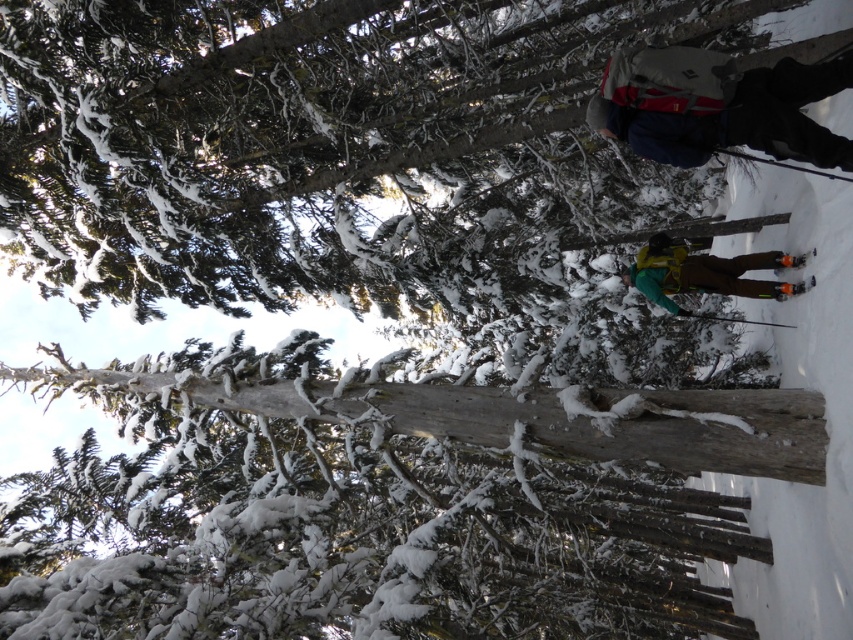
Is point (618, 51) closer to viewer compared to point (788, 285)?

Yes, point (618, 51) is closer to viewer.

Can you confirm if gray fabric backpack at upper right is positioned above orange reflective ski at lower right?

Correct, gray fabric backpack at upper right is located above orange reflective ski at lower right.

The image size is (853, 640). I want to click on gray fabric backpack at upper right, so point(717,106).

This screenshot has height=640, width=853. Identify the location of gray fabric backpack at upper right. (717, 106).

Is gray fabric backpack at upper right shorter than yellow-green fabric snowboard at center?

Correct, gray fabric backpack at upper right is not as tall as yellow-green fabric snowboard at center.

Does point (792, 156) lie in front of point (741, 253)?

Yes.

Describe the element at coordinates (717, 106) in the screenshot. The width and height of the screenshot is (853, 640). I see `gray fabric backpack at upper right` at that location.

The width and height of the screenshot is (853, 640). Identify the location of gray fabric backpack at upper right. (717, 106).

Is yellow-green fabric snowboard at center thinner than orange reflective ski at lower right?

In fact, yellow-green fabric snowboard at center might be wider than orange reflective ski at lower right.

In the scene shown: Between yellow-green fabric snowboard at center and orange reflective ski at lower right, which one has less height?

orange reflective ski at lower right

The width and height of the screenshot is (853, 640). Describe the element at coordinates (706, 273) in the screenshot. I see `yellow-green fabric snowboard at center` at that location.

The height and width of the screenshot is (640, 853). I want to click on yellow-green fabric snowboard at center, so click(x=706, y=273).